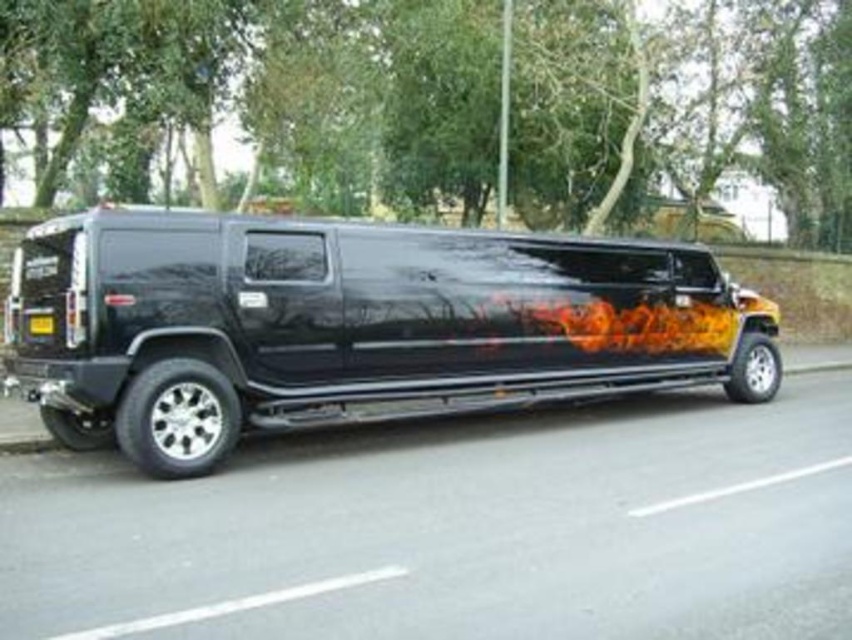
Question: Which of the following is the closest to the observer?

Choices:
 (A) glossy black limousine at center
 (B) yellow matte license plate at rear

Answer: (A)

Question: Which object is closer to the camera taking this photo?

Choices:
 (A) yellow matte license plate at rear
 (B) glossy black limousine at center

Answer: (B)

Question: Does glossy black limousine at center have a greater width compared to yellow matte license plate at rear?

Choices:
 (A) yes
 (B) no

Answer: (B)

Question: Among these points, which one is farthest from the camera?

Choices:
 (A) (33, 316)
 (B) (406, 403)

Answer: (B)

Question: Does glossy black limousine at center have a greater width compared to yellow matte license plate at rear?

Choices:
 (A) yes
 (B) no

Answer: (B)

Question: Is glossy black limousine at center above yellow matte license plate at rear?

Choices:
 (A) no
 (B) yes

Answer: (A)